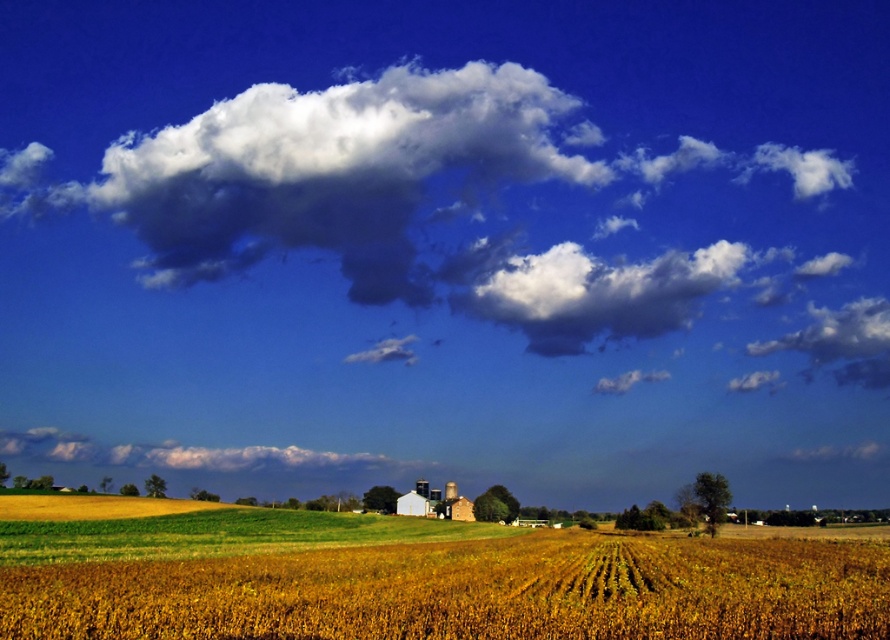
Question: In this image, where is yellow matte wheat field at center located relative to white fluffy cloud at lower center?

Choices:
 (A) left
 (B) right

Answer: (B)

Question: Which of the following is the closest to the observer?

Choices:
 (A) white fluffy cloud at upper center
 (B) white fluffy cloud at lower center

Answer: (A)

Question: Which of the following is the closest to the observer?

Choices:
 (A) yellow matte wheat field at center
 (B) white fluffy cloud at upper center

Answer: (A)

Question: Observing the image, what is the correct spatial positioning of yellow matte wheat field at center in reference to white fluffy cloud at lower center?

Choices:
 (A) below
 (B) above

Answer: (B)

Question: From the image, what is the correct spatial relationship of yellow matte wheat field at center in relation to white fluffy cloud at upper center?

Choices:
 (A) above
 (B) below

Answer: (B)

Question: Estimate the real-world distances between objects in this image. Which object is closer to the white fluffy cloud at upper center?

Choices:
 (A) white fluffy cloud at lower center
 (B) yellow matte wheat field at center

Answer: (A)